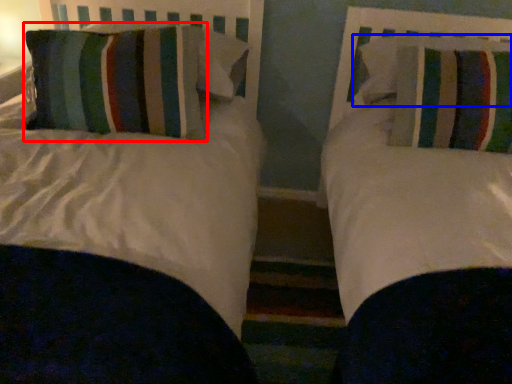
Question: Which of the following is the farthest to the observer, pillow (highlighted by a red box) or pillow (highlighted by a blue box)?

Choices:
 (A) pillow
 (B) pillow

Answer: (B)